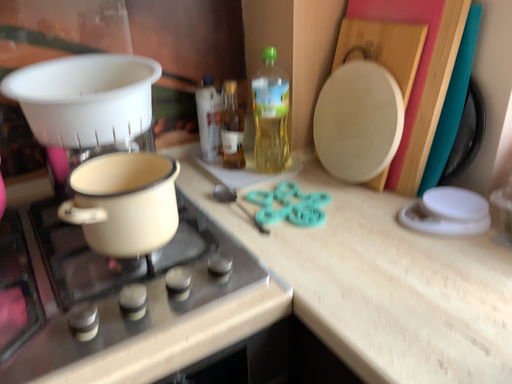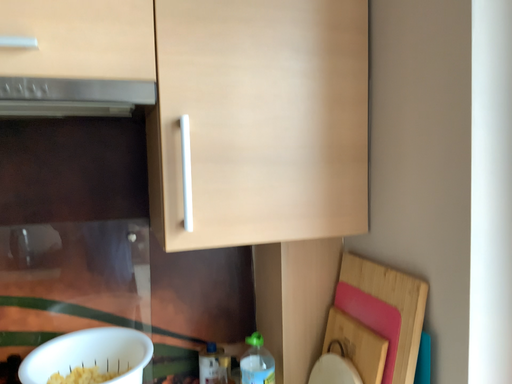
Question: Which way did the camera rotate in the video?

Choices:
 (A) rotated left
 (B) rotated right

Answer: (A)